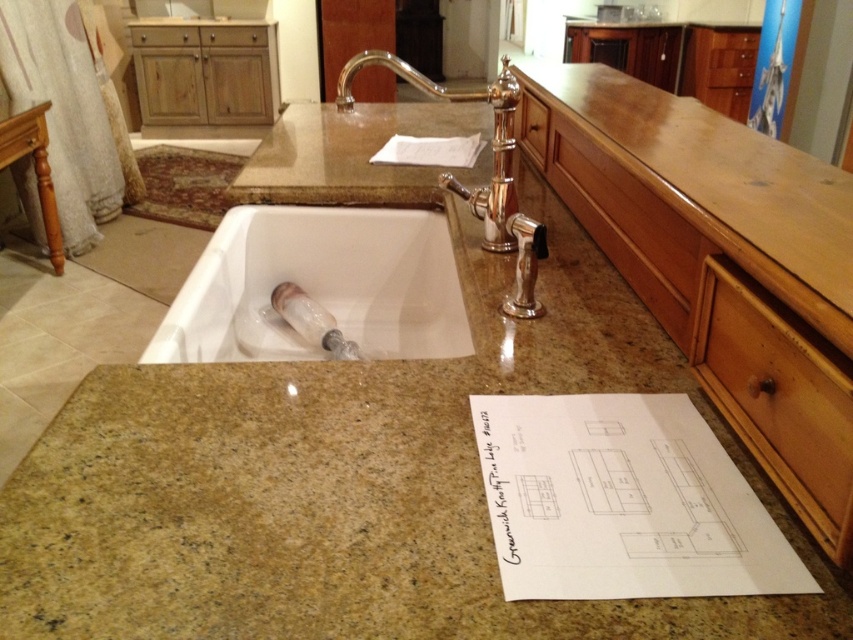
Question: Which point appears closest to the camera in this image?

Choices:
 (A) (161, 26)
 (B) (476, 140)
 (C) (229, 28)

Answer: (B)

Question: Observing the image, what is the correct spatial positioning of polished chrome faucet at center in reference to brown wood drawer at upper right?

Choices:
 (A) above
 (B) below

Answer: (B)

Question: Which object is farther from the camera taking this photo?

Choices:
 (A) white glossy sink at center
 (B) polished chrome faucet at center
 (C) brown wood drawer at upper right

Answer: (C)

Question: Can you confirm if polished chrome faucet at center is positioned below wooden drawer at upper left?

Choices:
 (A) yes
 (B) no

Answer: (A)

Question: Is brown wood drawer at upper center further to camera compared to wooden drawer at upper left?

Choices:
 (A) yes
 (B) no

Answer: (A)

Question: Which of these objects is positioned farthest from the white glossy sink at center?

Choices:
 (A) wooden drawer at upper left
 (B) brown wood drawer at upper center
 (C) white paper at center
 (D) brown wood drawer at upper right

Answer: (A)